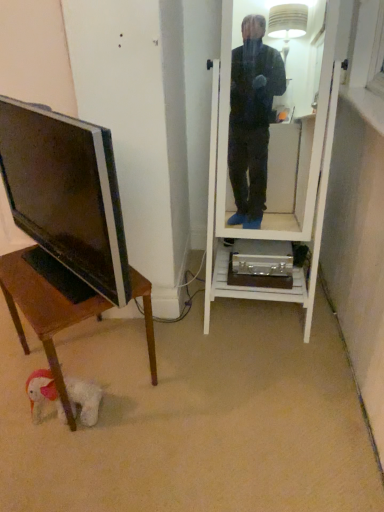
Question: Does matte black tv at left have a greater width compared to white glossy mirror at center?

Choices:
 (A) yes
 (B) no

Answer: (B)

Question: From the image's perspective, is matte black tv at left below white glossy mirror at center?

Choices:
 (A) no
 (B) yes

Answer: (B)

Question: Considering the relative sizes of matte black tv at left and white glossy mirror at center in the image provided, is matte black tv at left shorter than white glossy mirror at center?

Choices:
 (A) no
 (B) yes

Answer: (B)

Question: Can we say matte black tv at left lies outside white glossy mirror at center?

Choices:
 (A) no
 (B) yes

Answer: (B)

Question: Is matte black tv at left surrounding white glossy mirror at center?

Choices:
 (A) no
 (B) yes

Answer: (A)

Question: From the image's perspective, does matte black tv at left appear higher than white glossy mirror at center?

Choices:
 (A) yes
 (B) no

Answer: (B)

Question: Considering the relative positions of wooden desk at lower left and matte black tv at left in the image provided, is wooden desk at lower left to the right of matte black tv at left from the viewer's perspective?

Choices:
 (A) yes
 (B) no

Answer: (A)

Question: Is wooden desk at lower left next to matte black tv at left?

Choices:
 (A) yes
 (B) no

Answer: (B)

Question: Is wooden desk at lower left far away from matte black tv at left?

Choices:
 (A) yes
 (B) no

Answer: (B)

Question: Is wooden desk at lower left facing away from matte black tv at left?

Choices:
 (A) yes
 (B) no

Answer: (B)

Question: Considering the relative sizes of wooden desk at lower left and matte black tv at left in the image provided, is wooden desk at lower left smaller than matte black tv at left?

Choices:
 (A) no
 (B) yes

Answer: (A)

Question: Does wooden desk at lower left have a larger size compared to matte black tv at left?

Choices:
 (A) yes
 (B) no

Answer: (A)

Question: Can you see matte black tv at left touching wooden desk at lower left?

Choices:
 (A) no
 (B) yes

Answer: (A)